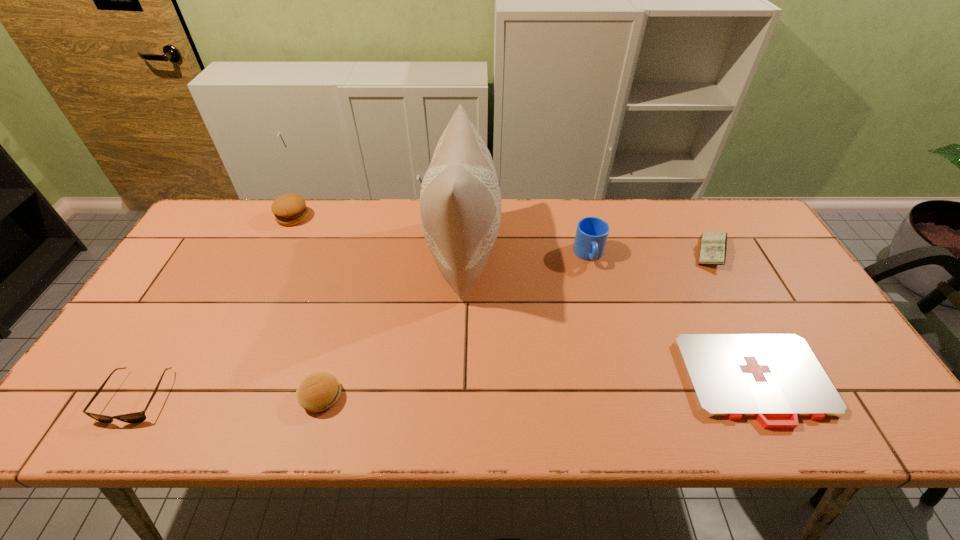
What are the coordinates of `vacant area at the left edge of the desktop` in the screenshot? It's located at (145, 363).

Locate an element on the screen. The image size is (960, 540). blank space at the right edge is located at coordinates [x=781, y=274].

The width and height of the screenshot is (960, 540). In order to click on free space at the far left corner of the desktop in this screenshot , I will do `click(196, 245)`.

This screenshot has width=960, height=540. Identify the location of free spot at the near left corner of the desktop. (71, 417).

Locate an element on the screen. This screenshot has width=960, height=540. vacant position at the far right corner of the desktop is located at coordinates (734, 205).

Image resolution: width=960 pixels, height=540 pixels. Find the location of `free area in between the fifth shortest object and the first-aid kit`. free area in between the fifth shortest object and the first-aid kit is located at coordinates (524, 299).

Identify the location of blank region between the shortest object and the third object from left to right. (539, 388).

Where is `free point between the mug and the shortest object`? The image size is (960, 540). free point between the mug and the shortest object is located at coordinates (672, 318).

You are a GUI agent. You are given a task and a screenshot of the screen. Output one action in this format:
    pyautogui.click(x=<x>, y=<y>)
    Task: Click on the empty space that is in between the shortest object and the leftmost object
    Image resolution: width=960 pixels, height=540 pixels.
    Given the screenshot: What is the action you would take?
    pyautogui.click(x=446, y=388)

Where is `free space between the sixth object from right to left and the cushion`? This screenshot has width=960, height=540. free space between the sixth object from right to left and the cushion is located at coordinates (378, 234).